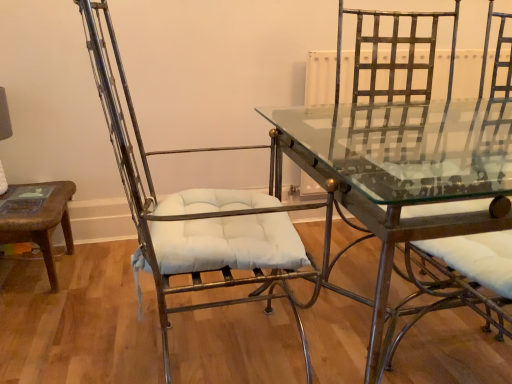
Question: Based on their sizes in the image, would you say clear glass table at center is bigger or smaller than metallic wire chair at left?

Choices:
 (A) small
 (B) big

Answer: (B)

Question: In terms of width, does clear glass table at center look wider or thinner when compared to metallic wire chair at left?

Choices:
 (A) thin
 (B) wide

Answer: (B)

Question: Which object is the farthest from the clear glass table at center?

Choices:
 (A) metallic gold swivel chair at right
 (B) metallic wire chair at left

Answer: (A)

Question: Estimate the real-world distances between objects in this image. Which object is farther from the metallic gold swivel chair at right?

Choices:
 (A) clear glass table at center
 (B) metallic wire chair at left

Answer: (A)